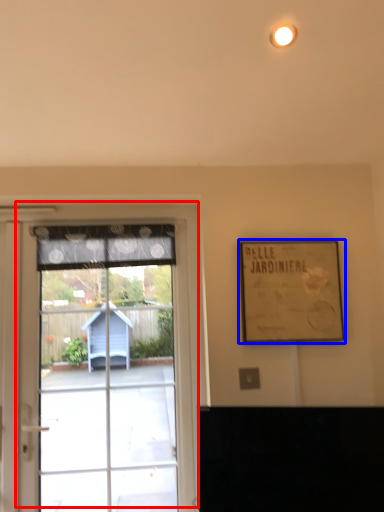
Question: Which object appears closest to the camera in this image, window (highlighted by a red box) or picture frame (highlighted by a blue box)?

Choices:
 (A) window
 (B) picture frame

Answer: (B)